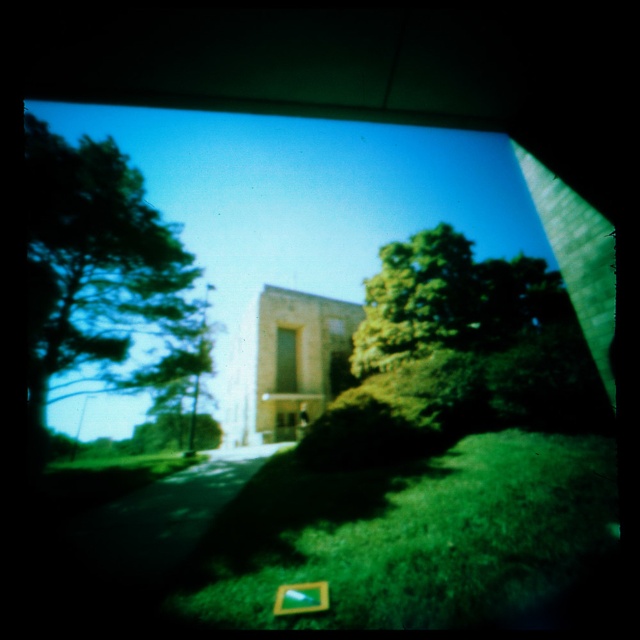
Between green grass at lower center and green leafy tree at left, which one appears on the left side from the viewer's perspective?

From the viewer's perspective, green leafy tree at left appears more on the left side.

Is point (420, 627) farther from viewer compared to point (56, 182)?

That is False.

This screenshot has height=640, width=640. What do you see at coordinates (410, 536) in the screenshot? I see `green grass at lower center` at bounding box center [410, 536].

At what (x,y) coordinates should I click in order to perform the action: click on green grass at lower center. Please return your answer as a coordinate pair (x, y). Looking at the image, I should click on (410, 536).

Can you confirm if green leafy tree at left is bigger than green leafy tree at center?

Yes.

Between green leafy tree at left and green leafy tree at center, which one has more height?

green leafy tree at left is taller.

Who is more distant from viewer, (106, 284) or (374, 321)?

The point (374, 321) is more distant.

Identify the location of green leafy tree at left. (102, 275).

Between point (433, 474) and point (442, 276), which one is positioned in front?

Positioned in front is point (433, 474).

Based on the photo, who is more distant from viewer, (193, 596) or (531, 282)?

Positioned behind is point (531, 282).

Find the location of `green grass at lower center`. green grass at lower center is located at coordinates (410, 536).